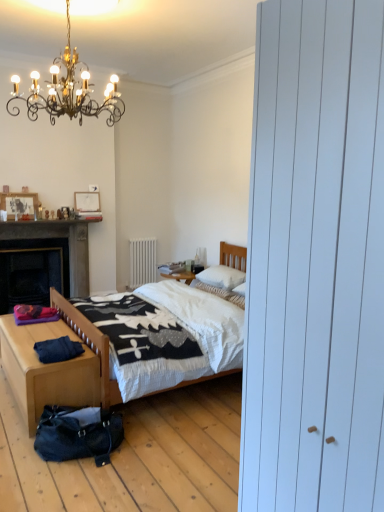
Question: From a real-world perspective, is white quilted bed at center physically located above or below wooden picture frame at upper left, the second picture frame in the right-to-left sequence?

Choices:
 (A) above
 (B) below

Answer: (B)

Question: From the image's perspective, is white quilted bed at center located above or below wooden picture frame at upper left, which is the second picture frame in back-to-front order?

Choices:
 (A) below
 (B) above

Answer: (A)

Question: Which of these objects is positioned farthest from the matte white fireplace at upper left?

Choices:
 (A) white soft pillow at center, which is counted as the 2th pillow, starting from the top
 (B) dark blue cotton pants at lower left
 (C) white paper at upper left, the second picture frame when ordered from left to right
 (D) gold wrought iron chandelier at upper left
 (E) white quilted bed at center

Answer: (B)

Question: Estimate the real-world distances between objects in this image. Which object is closer to the light wood/texture nightstand at lower left?

Choices:
 (A) gold wrought iron chandelier at upper left
 (B) white soft pillow at center, the first pillow ordered from the bottom
 (C) wooden table at lower left
 (D) white soft pillow at center, which ranks as the 2th pillow in bottom-to-top order
 (E) leather textured bag at lower left

Answer: (E)